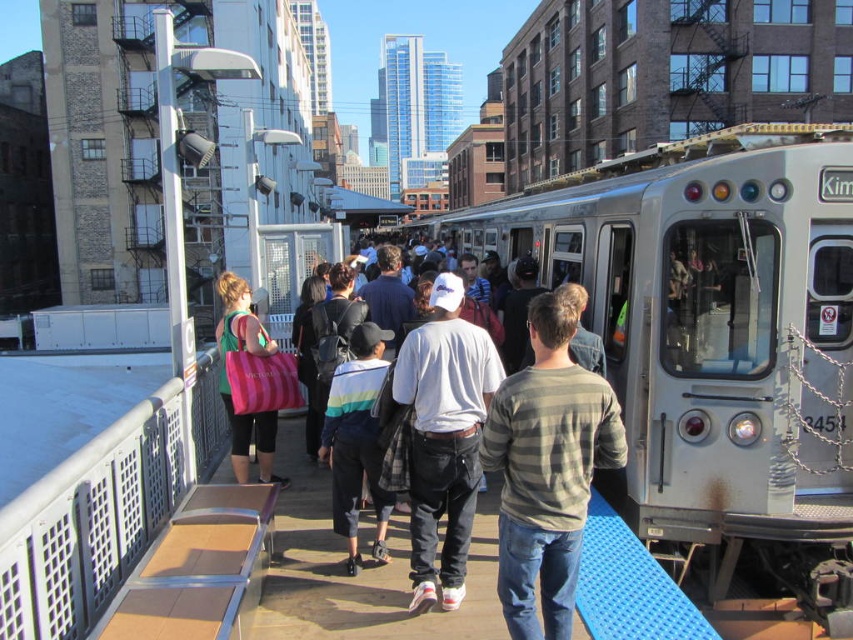
Question: Which point is closer to the camera taking this photo?

Choices:
 (A) (845, 525)
 (B) (383, 600)

Answer: (B)

Question: Which point is farther from the camera taking this photo?

Choices:
 (A) (x=450, y=621)
 (B) (x=573, y=556)
 (C) (x=544, y=266)
 (D) (x=482, y=348)

Answer: (C)

Question: Is silver metallic train at center further to the viewer compared to striped shirt at center?

Choices:
 (A) no
 (B) yes

Answer: (B)

Question: Does silver metallic train at center appear under striped cotton shirt at center?

Choices:
 (A) no
 (B) yes

Answer: (A)

Question: Is silver metallic train at center closer to the viewer compared to striped cotton shirt at center?

Choices:
 (A) no
 (B) yes

Answer: (A)

Question: Among these points, which one is nearest to the camera?

Choices:
 (A) (531, 560)
 (B) (846, 540)

Answer: (A)